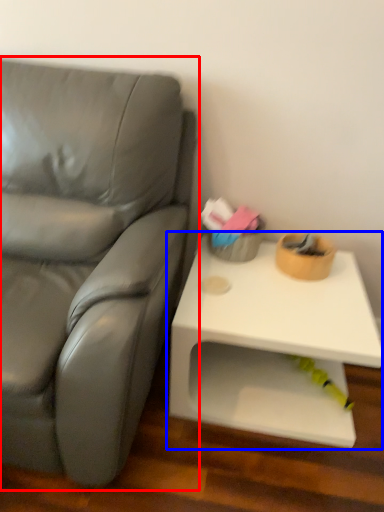
Question: Which of the following is the farthest to the observer, studio couch (highlighted by a red box) or table (highlighted by a blue box)?

Choices:
 (A) studio couch
 (B) table

Answer: (B)